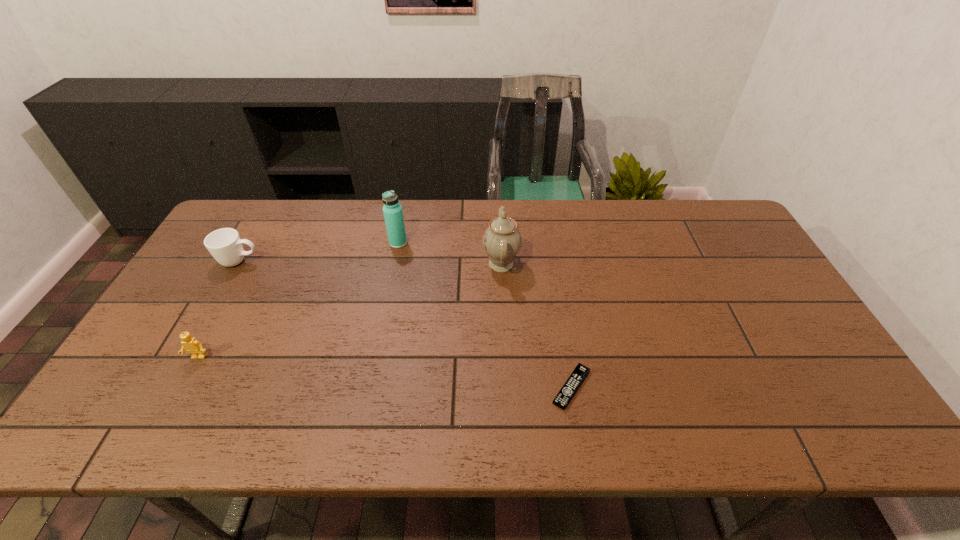
Locate an element on the screen. vacant space located 0.210m with the handle on the side of the cup is located at coordinates 328,261.

The height and width of the screenshot is (540, 960). I want to click on vacant space located on the face of the Lego, so click(x=180, y=391).

Identify the location of vacant space located on the left of the rightmost object. (445, 387).

At what (x,y) coordinates should I click in order to perform the action: click on chinaware at the far edge. Please return your answer as a coordinate pair (x, y). This screenshot has height=540, width=960. Looking at the image, I should click on (502, 240).

Find the location of `thermos bottle at the far edge`. thermos bottle at the far edge is located at coordinates (392, 210).

Locate an element on the screen. object situated at the near edge is located at coordinates (574, 381).

The image size is (960, 540). In order to click on cup positioned at the left edge in this screenshot , I will do `click(225, 245)`.

This screenshot has width=960, height=540. I want to click on Lego present at the left edge, so click(190, 344).

At what (x,y) coordinates should I click in order to perform the action: click on free space at the far edge of the desktop. Please return your answer as a coordinate pair (x, y). Looking at the image, I should click on (481, 215).

Identify the location of vacant space at the right edge of the desktop. This screenshot has width=960, height=540. (744, 299).